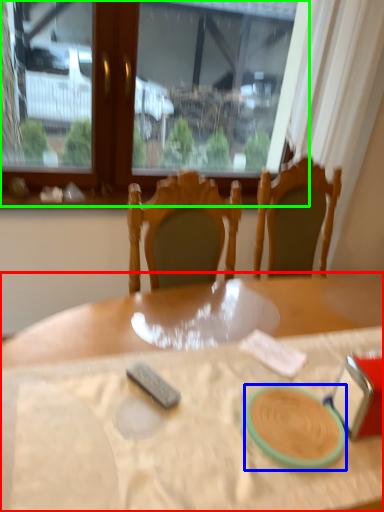
Question: Which object is positioned farthest from table (highlighted by a red box)? Select from tableware (highlighted by a blue box) and window (highlighted by a green box).

Choices:
 (A) tableware
 (B) window

Answer: (B)